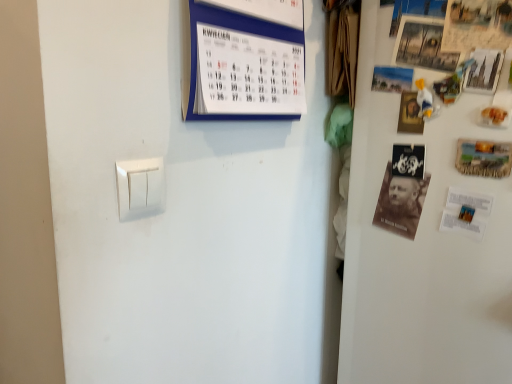
Question: Visually, is metallic silver poster at upper right, which is the first poster from right to left, positioned to the left or to the right of wooden framed poster at upper right, marked as the 2th poster in a left-to-right arrangement?

Choices:
 (A) right
 (B) left

Answer: (A)

Question: In terms of height, does metallic silver poster at upper right, the 3th poster in the left-to-right sequence, look taller or shorter compared to wooden framed poster at upper right, the 2th poster in the right-to-left sequence?

Choices:
 (A) short
 (B) tall

Answer: (A)

Question: Which of these objects is positioned farthest from the wooden postcard at right?

Choices:
 (A) metallic silver poster at upper right, the 3th poster in the left-to-right sequence
 (B) white paper calendar at upper center, marked as the 1th magazine in a left-to-right arrangement
 (C) brown paper at right, which is counted as the first magazine, starting from the bottom
 (D) matte paper poster at upper right, positioned as the 1th poster in left-to-right order
 (E) white plastic light switch at lower left

Answer: (E)

Question: Estimate the real-world distances between objects in this image. Which object is closer to the white plastic light switch at lower left?

Choices:
 (A) brown paper at right, the 2th magazine from the left
 (B) metallic silver poster at upper right, the 3th poster in the left-to-right sequence
 (C) wooden postcard at right
 (D) white matte fridge at upper right
 (E) matte paper poster at upper right, which ranks as the third poster in right-to-left order

Answer: (A)